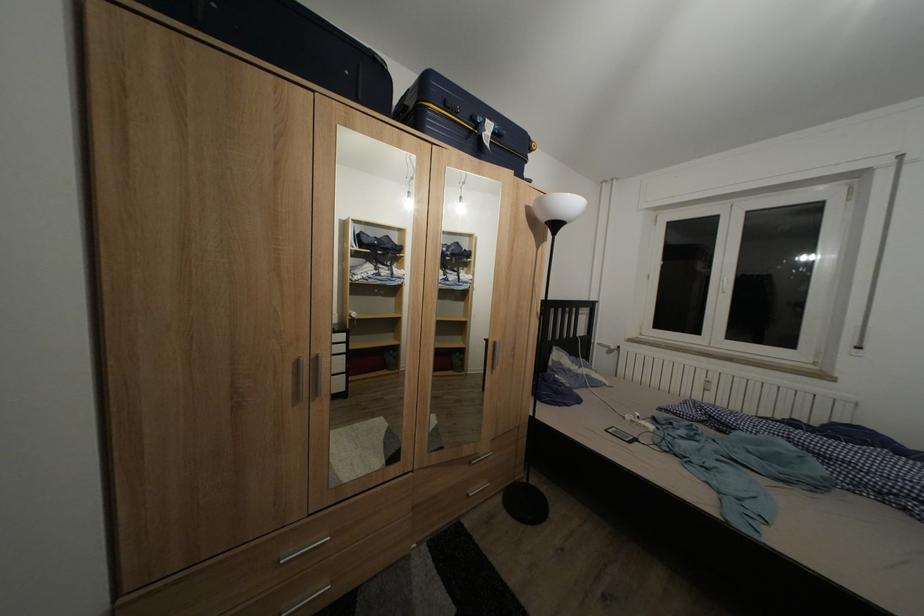
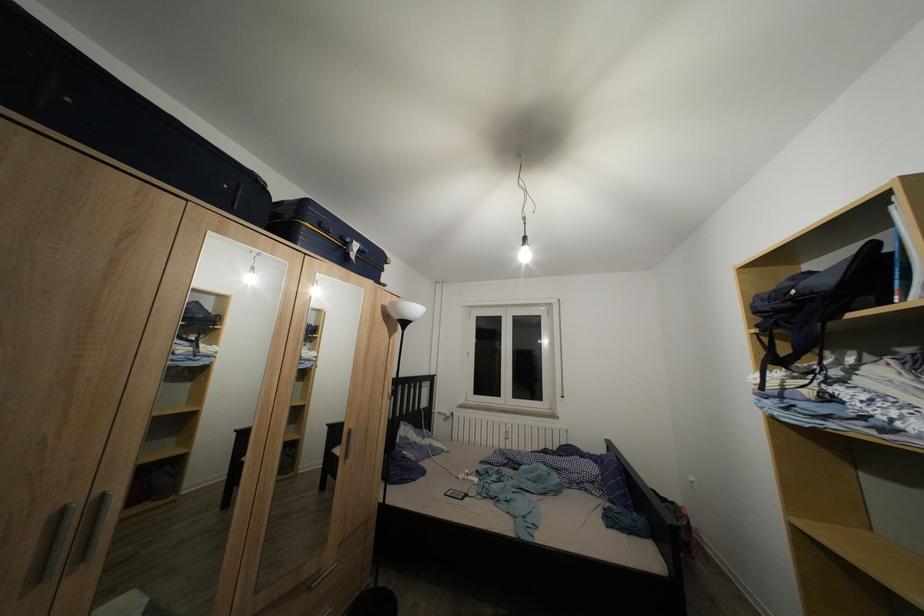
In the second image, find the point that corresponds to (x=502, y=139) in the first image.

(367, 257)